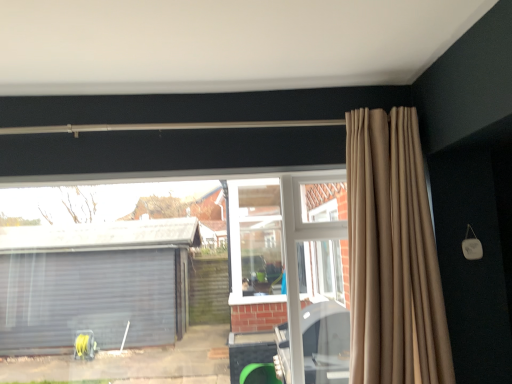
Question: From a real-world perspective, does transparent glass window at center sit lower than beige fabric curtain at upper right?

Choices:
 (A) yes
 (B) no

Answer: (A)

Question: Is transparent glass window at center bigger than beige fabric curtain at upper right?

Choices:
 (A) yes
 (B) no

Answer: (B)

Question: From the image's perspective, is transparent glass window at center on top of beige fabric curtain at upper right?

Choices:
 (A) yes
 (B) no

Answer: (B)

Question: Considering the relative sizes of transparent glass window at center and beige fabric curtain at upper right in the image provided, is transparent glass window at center shorter than beige fabric curtain at upper right?

Choices:
 (A) no
 (B) yes

Answer: (B)

Question: Is transparent glass window at center positioned in front of beige fabric curtain at upper right?

Choices:
 (A) no
 (B) yes

Answer: (A)

Question: Is transparent glass window at center wider than beige fabric curtain at upper right?

Choices:
 (A) no
 (B) yes

Answer: (A)

Question: Is beige fabric curtain at upper right taller than transparent glass window at center?

Choices:
 (A) no
 (B) yes

Answer: (B)

Question: From the image's perspective, would you say beige fabric curtain at upper right is positioned over transparent glass window at center?

Choices:
 (A) no
 (B) yes

Answer: (B)

Question: Can you confirm if beige fabric curtain at upper right is smaller than transparent glass window at center?

Choices:
 (A) no
 (B) yes

Answer: (A)

Question: From a real-world perspective, is beige fabric curtain at upper right located beneath transparent glass window at center?

Choices:
 (A) yes
 (B) no

Answer: (B)

Question: Is beige fabric curtain at upper right completely or partially outside of transparent glass window at center?

Choices:
 (A) no
 (B) yes

Answer: (B)

Question: From the image's perspective, is beige fabric curtain at upper right beneath transparent glass window at center?

Choices:
 (A) yes
 (B) no

Answer: (B)

Question: Is point (373, 165) closer or farther from the camera than point (67, 307)?

Choices:
 (A) closer
 (B) farther

Answer: (A)